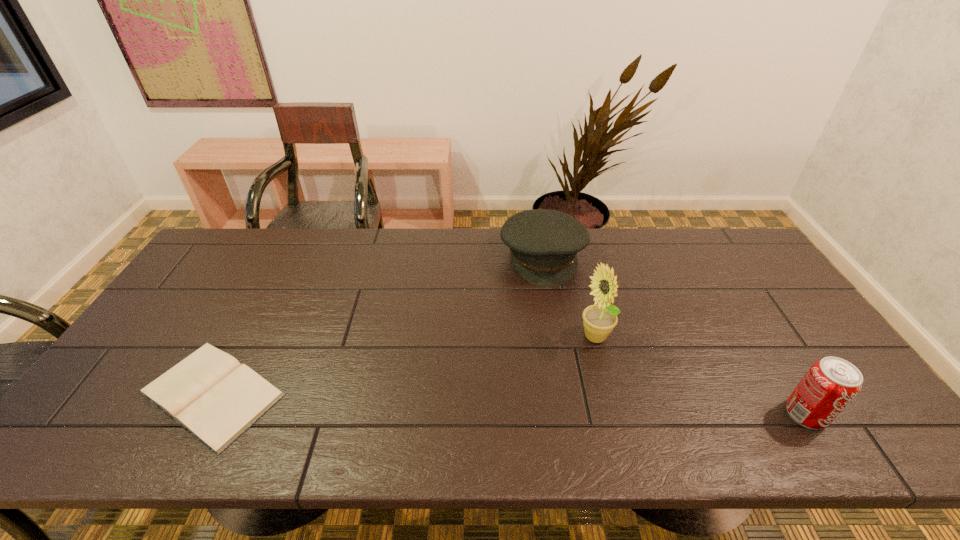
This screenshot has height=540, width=960. I want to click on Bible, so click(213, 396).

Where is `the leftmost object`? This screenshot has height=540, width=960. the leftmost object is located at coordinates (213, 396).

The height and width of the screenshot is (540, 960). I want to click on soda can, so click(831, 383).

Image resolution: width=960 pixels, height=540 pixels. What are the coordinates of `the rightmost object` in the screenshot? It's located at (831, 383).

Where is `sunflower`? sunflower is located at coordinates (599, 320).

Find the location of a particular element. the farthest object is located at coordinates (543, 243).

Locate an element on the screen. This screenshot has width=960, height=540. the second shortest object is located at coordinates (543, 243).

The image size is (960, 540). What are the coordinates of `free space located 0.390m on the right of the shortest object` in the screenshot? It's located at (446, 393).

At what (x,y) coordinates should I click in order to perform the action: click on vacant area located 0.330m on the left of the rightmost object. Please return your answer as a coordinate pair (x, y). This screenshot has height=540, width=960. Looking at the image, I should click on (645, 414).

This screenshot has height=540, width=960. Identify the location of free space located 0.240m on the face of the sunflower. (541, 414).